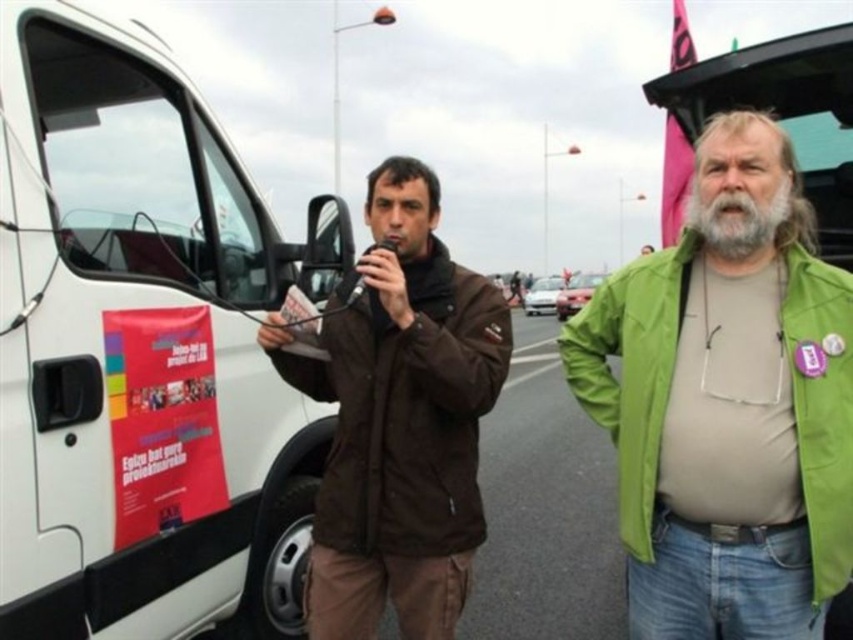
Between graywoollybeard at right and metallic silver car at center, which one is positioned lower?

Positioned lower is graywoollybeard at right.

Can you confirm if graywoollybeard at right is positioned below metallic silver car at center?

Correct, graywoollybeard at right is located below metallic silver car at center.

Describe the element at coordinates (737, 220) in the screenshot. The image size is (853, 640). I see `graywoollybeard at right` at that location.

Image resolution: width=853 pixels, height=640 pixels. I want to click on graywoollybeard at right, so click(737, 220).

Between point (682, 308) and point (549, 291), which one is positioned in front?

Point (682, 308)

Is point (827, 378) positioned behind point (556, 280)?

No, (827, 378) is closer to viewer.

Between point (630, 397) and point (550, 312), which one is positioned in front?

Point (630, 397) is in front.

This screenshot has height=640, width=853. What are the coordinates of `green matte jacket at right` in the screenshot? It's located at (631, 372).

Where is `white matte van at left`? white matte van at left is located at coordinates (142, 349).

How distant is white matte van at left from brown matte jacket at center?

white matte van at left and brown matte jacket at center are 28.64 inches apart.

Which is in front, point (106, 570) or point (338, 536)?

Point (106, 570)

I want to click on white matte van at left, so click(142, 349).